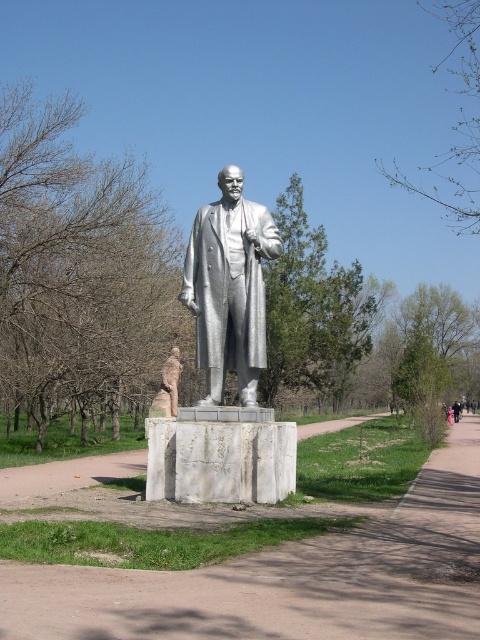
In the scene shown: You are an art student visiting a park with two statues. You see the polished silver statue at center and the matte bronze statue at center. Which statue should you stand closer to in order to fully see its intricate details?

The polished silver statue at center is bigger than the matte bronze statue at center, so you should stand closer to the matte bronze statue at center to fully see its intricate details.

You are standing at point [287,577] in the park. What is the object located at your current position?

The object located at point [287,577] is the white marble path at center.